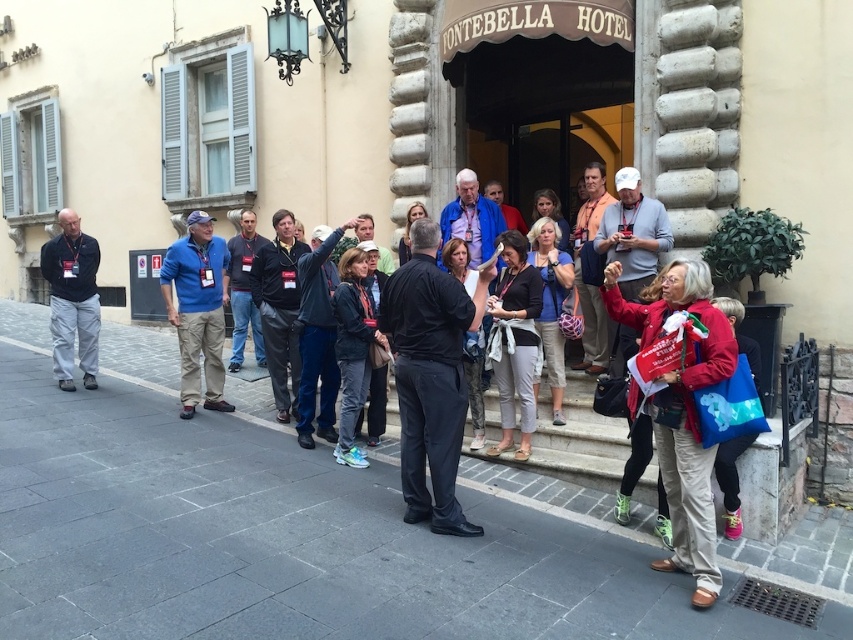
Question: Estimate the real-world distances between objects in this image. Which object is closer to the gray stone pavement at center?

Choices:
 (A) red fabric bag at lower right
 (B) blue denim jeans at center
 (C) dark blue jacket at center
 (D) dark gray jacket at left

Answer: (C)

Question: Which point is farther from the camera taking this photo?

Choices:
 (A) (361, 273)
 (B) (538, 262)
 (C) (177, 534)
 (D) (465, 280)

Answer: (B)

Question: Is gray stone pavement at center positioned behind dark gray fabric pants at center?

Choices:
 (A) no
 (B) yes

Answer: (A)

Question: Is dark blue jacket at center thinner than blue denim jeans at center?

Choices:
 (A) no
 (B) yes

Answer: (A)

Question: Among these objects, which one is farthest from the camera?

Choices:
 (A) dark gray jacket at left
 (B) black leather jacket at center
 (C) dark gray fabric pants at center

Answer: (A)

Question: Does blue denim jeans at center appear over black leather jacket at center?

Choices:
 (A) no
 (B) yes

Answer: (B)